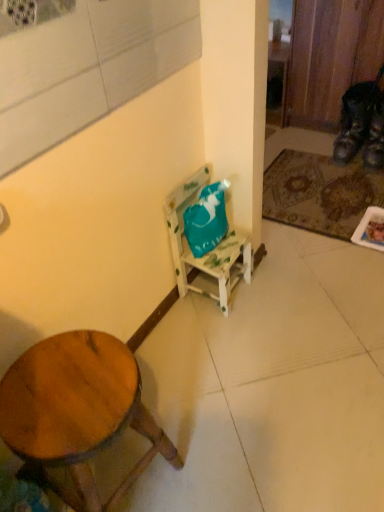
You are a GUI agent. You are given a task and a screenshot of the screen. Output one action in this format:
    pyautogui.click(x=<x>, y=<y>)
    Task: Click on the free spot above brown textured mat at lower right (from a real-world perspective)
    Image resolution: width=384 pixels, height=512 pixels.
    Given the screenshot: What is the action you would take?
    pyautogui.click(x=324, y=192)